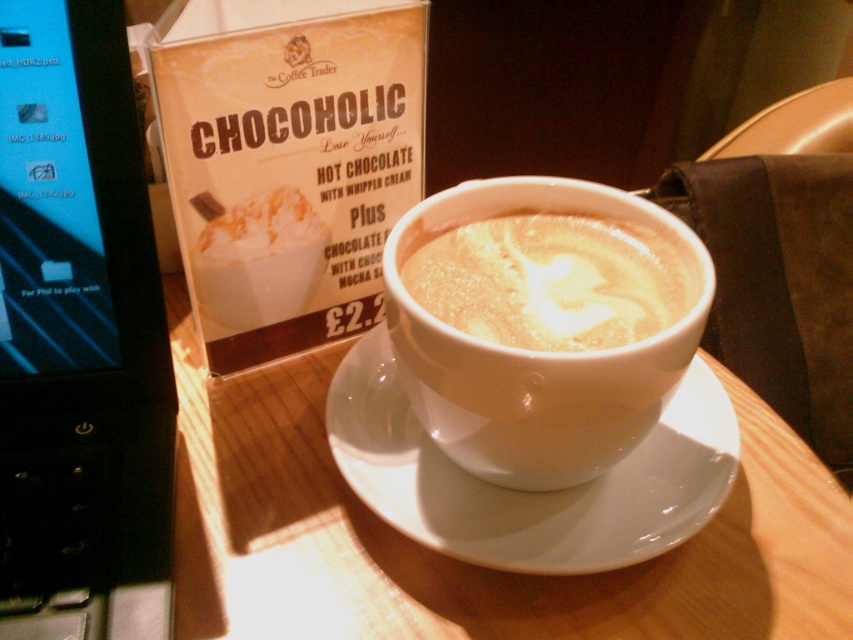
You are a customer sitting at the wooden table in the cozy cafe scene. You want to place your black plastic laptop at left on the table without covering the white ceramic mug with hot chocolate. Is there enough space on the table for the laptop next to the mug?

Yes, there is enough space on the table for the black plastic laptop at left next to the white ceramic mug with hot chocolate since the laptop is located at point (79, 337), which is to the left of the mug, allowing space on the right side for placement without obstruction.

You are sitting at the wooden table in the cozy cafe. You see two points marked on the table. The first point is at coordinates point (44,236) and the second point is at point (624,337). If you want to place a small sugar cube between these two points so that it is closer to the point that is behind the other, where should you place it?

The point at (44,236) is behind point (624,337). To place the sugar cube closer to the point that is behind, you should position it near point (44,236).